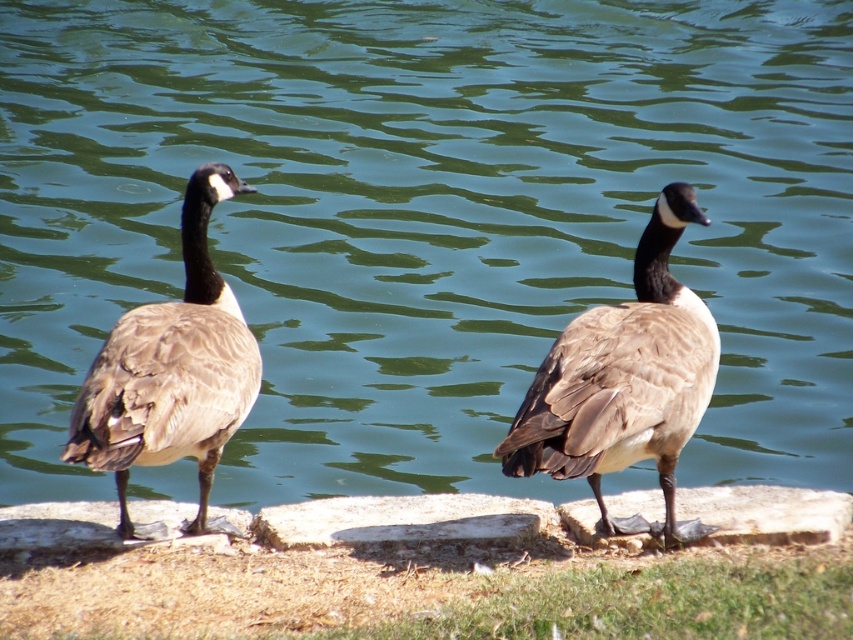
Can you confirm if brown feathered duck at center is bigger than brown feathered duck at left?

Correct, brown feathered duck at center is larger in size than brown feathered duck at left.

Between brown feathered duck at center and brown feathered duck at left, which one has more height?

brown feathered duck at left is taller.

Does point (695, 326) come in front of point (235, 305)?

Yes, point (695, 326) is in front of point (235, 305).

You are a GUI agent. You are given a task and a screenshot of the screen. Output one action in this format:
    pyautogui.click(x=<x>, y=<y>)
    Task: Click on the brown feathered duck at center
    The image size is (853, 640).
    Given the screenshot: What is the action you would take?
    pyautogui.click(x=625, y=381)